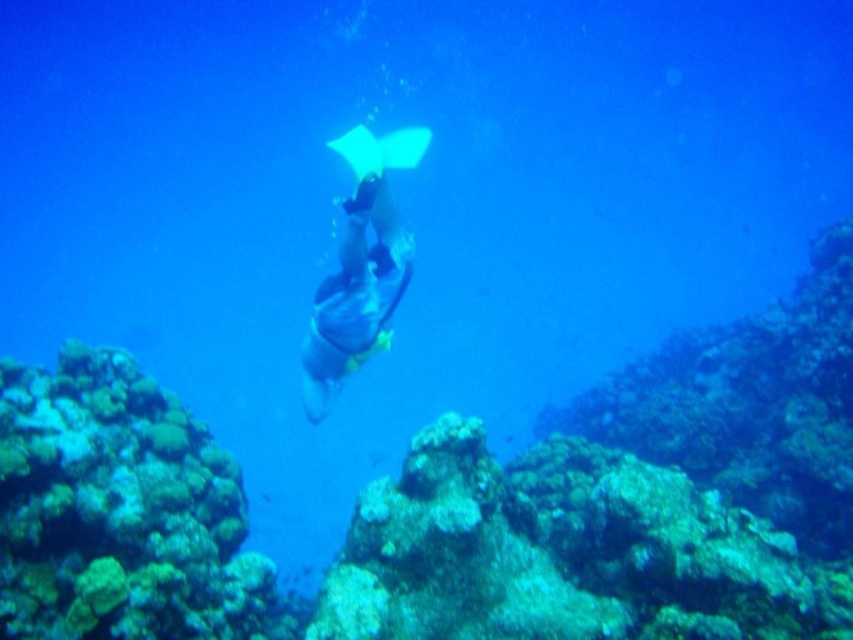
Does rough textured coral reef at center have a greater height compared to translucent white stingray at center?

Yes, rough textured coral reef at center is taller than translucent white stingray at center.

Can you confirm if rough textured coral reef at center is wider than translucent white stingray at center?

Indeed, rough textured coral reef at center has a greater width compared to translucent white stingray at center.

Which is in front, point (836, 532) or point (347, 150)?

Positioned in front is point (347, 150).

Where is `rough textured coral reef at center`? rough textured coral reef at center is located at coordinates (462, 504).

Find the location of a particular element. The image size is (853, 640). rough textured coral reef at center is located at coordinates (462, 504).

Can you confirm if rough textured coral reef at center is wider than blue rubber glove at center?

Indeed, rough textured coral reef at center has a greater width compared to blue rubber glove at center.

Is point (654, 564) positioned before point (378, 209)?

Yes, point (654, 564) is in front of point (378, 209).

Where is `rough textured coral reef at center`? rough textured coral reef at center is located at coordinates (462, 504).

Does blue rubber glove at center appear over translucent white stingray at center?

No.

Which of these two, blue rubber glove at center or translucent white stingray at center, stands taller?

Standing taller between the two is blue rubber glove at center.

What do you see at coordinates (355, 296) in the screenshot? Image resolution: width=853 pixels, height=640 pixels. I see `blue rubber glove at center` at bounding box center [355, 296].

I want to click on blue rubber glove at center, so (355, 296).